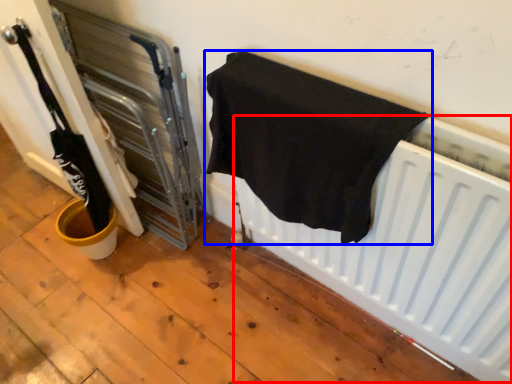
Question: Which of the following is the farthest to the observer, radiator (highlighted by a red box) or towel (highlighted by a blue box)?

Choices:
 (A) radiator
 (B) towel

Answer: (A)